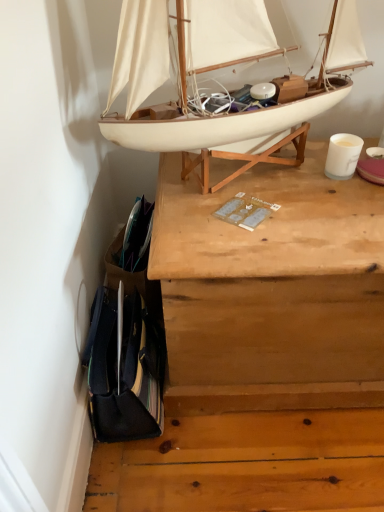
At what (x,y) coordinates should I click in order to perform the action: click on vacant space underneath white matte boat at upper center (from a real-world perspective). Please return your answer as a coordinate pair (x, y). Image resolution: width=384 pixels, height=512 pixels. Looking at the image, I should click on (263, 174).